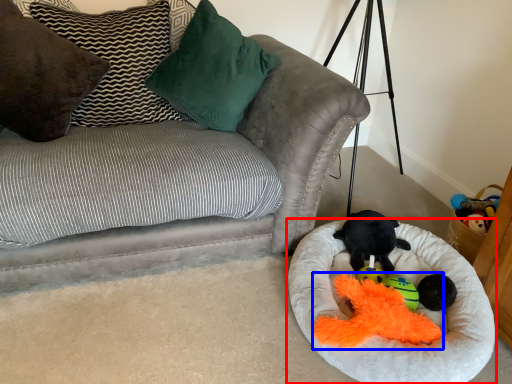
Question: Among these objects, which one is nearest to the camera, dog bed (highlighted by a red box) or miniature (highlighted by a blue box)?

Choices:
 (A) dog bed
 (B) miniature

Answer: (A)